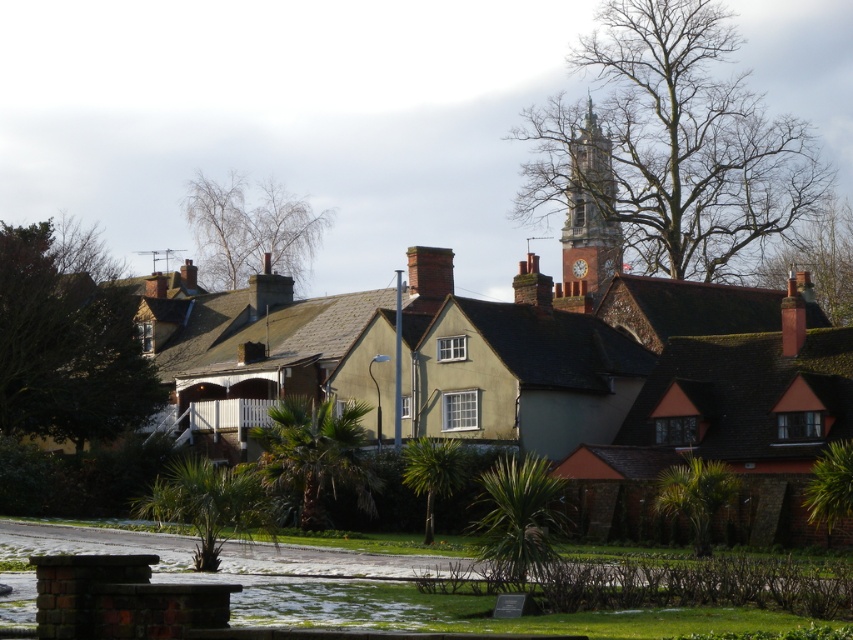
Question: Can you confirm if brick clock tower at upper center is bigger than brown brick chimney at center?

Choices:
 (A) no
 (B) yes

Answer: (B)

Question: Among these points, which one is farthest from the camera?

Choices:
 (A) (595, 145)
 (B) (409, 291)

Answer: (A)

Question: Which point appears farthest from the camera in this image?

Choices:
 (A) (438, 289)
 (B) (566, 189)

Answer: (B)

Question: Can you confirm if brick clock tower at upper center is thinner than brown brick chimney at center?

Choices:
 (A) no
 (B) yes

Answer: (A)

Question: Can you confirm if brick clock tower at upper center is thinner than brown brick chimney at center?

Choices:
 (A) no
 (B) yes

Answer: (A)

Question: Among these objects, which one is nearest to the camera?

Choices:
 (A) brick clock tower at upper center
 (B) brown brick chimney at center

Answer: (B)